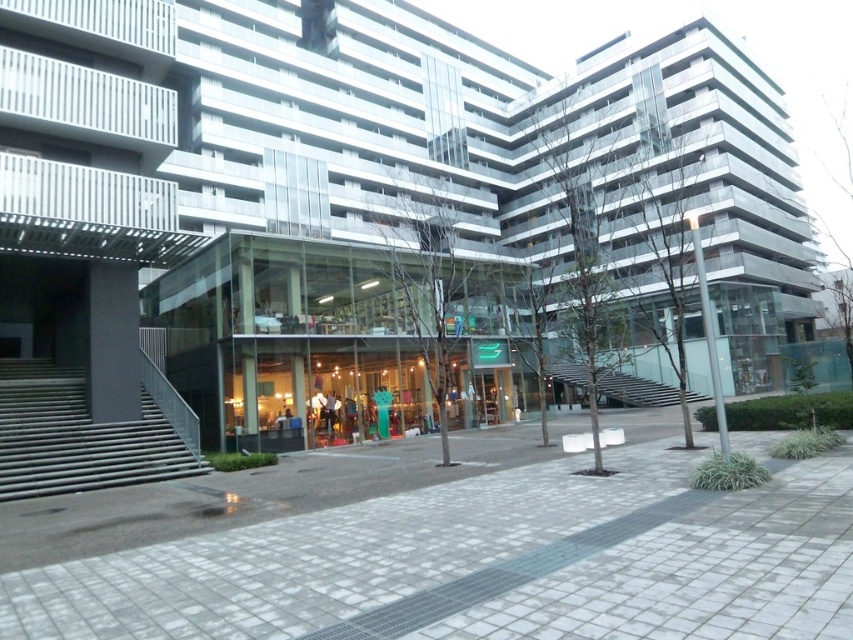
Question: Can you confirm if metallic gray stairs at left is thinner than glass transparent stairs at center?

Choices:
 (A) yes
 (B) no

Answer: (A)

Question: Which is nearer to the gray cobblestone pavement at center?

Choices:
 (A) metallic gray stairs at left
 (B) glass transparent stairs at center

Answer: (A)

Question: Which object is closer to the camera taking this photo?

Choices:
 (A) metallic gray stairs at left
 (B) glass transparent stairs at center

Answer: (B)

Question: Can you confirm if gray cobblestone pavement at center is smaller than metallic gray stairs at left?

Choices:
 (A) yes
 (B) no

Answer: (A)

Question: Is the position of metallic gray stairs at left less distant than that of glass transparent stairs at center?

Choices:
 (A) yes
 (B) no

Answer: (B)

Question: Which of these objects is positioned closest to the metallic gray stairs at left?

Choices:
 (A) gray cobblestone pavement at center
 (B) glass transparent stairs at center

Answer: (A)